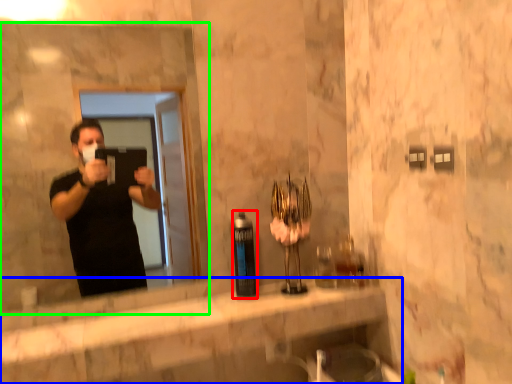
Question: Which object is the closest to the bottle (highlighted by a red box)? Choose among these: counter top (highlighted by a blue box) or mirror (highlighted by a green box).

Choices:
 (A) counter top
 (B) mirror

Answer: (A)